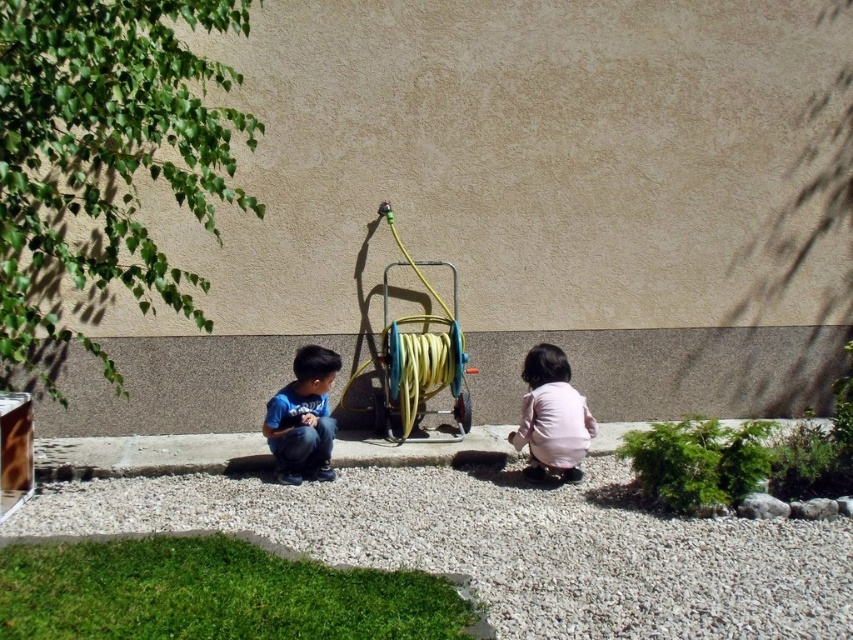
You are standing at the point closest to the wall. Which point, point (395, 508) or point (764, 502), is farther from you?

Point (395, 508) is behind point (764, 502), so it is farther from you.

You are standing at the center of the image and want to place a small potted plant exactly where the white gravel at lower center is located. According to the coordinates provided, what are the x and y values you should aim for?

The coordinates for the white gravel at lower center are x 0.853 and y 0.600.

You are a gardener who needs to place a small potted plant between the white gravel at lower center and the gray rough stone at lower right. Based on the scene, which object should the plant be closer to in order to stay within the visible area of the image?

The white gravel at lower center is closer to the viewer than the gray rough stone at lower right, so placing the plant closer to the white gravel at lower center would keep it within the visible area of the image.